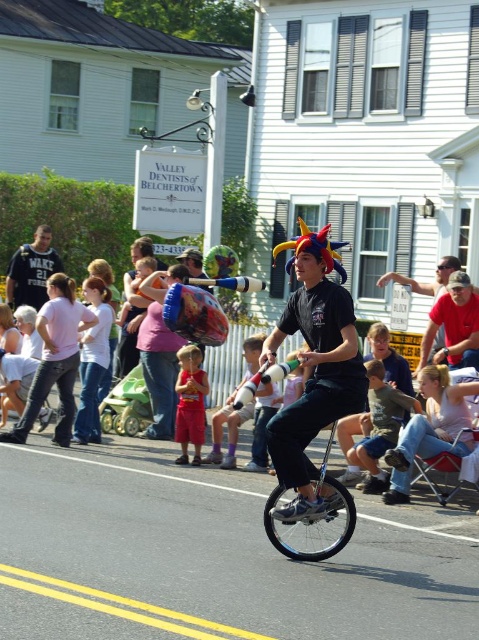
Question: From the image, what is the correct spatial relationship of matte black shirt at center in relation to matte black shirt at left?

Choices:
 (A) below
 (B) above

Answer: (A)

Question: Which point is farther to the camera?

Choices:
 (A) denim jeans at lower right
 (B) matte black shirt at left
 (C) denim shorts at lower right
 (D) red cotton shorts at center

Answer: (B)

Question: Is pink cotton shirt at lower left below matte black shirt at left?

Choices:
 (A) yes
 (B) no

Answer: (A)

Question: Which point appears farthest from the camera in this image?

Choices:
 (A) (190, 346)
 (B) (466, 432)

Answer: (A)

Question: Which object appears farthest from the camera in this image?

Choices:
 (A) matte black unicycle at center
 (B) red cotton shorts at center
 (C) jeans at left
 (D) matte black shirt at left

Answer: (D)

Question: Does denim shorts at lower right have a larger size compared to red cotton shorts at center?

Choices:
 (A) no
 (B) yes

Answer: (B)